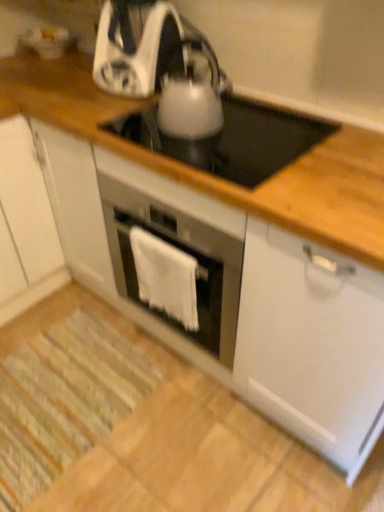
Question: Is point (192, 309) closer or farther from the camera than point (163, 103)?

Choices:
 (A) farther
 (B) closer

Answer: (A)

Question: Considering the positions of white fabric towel at center and satin silver kettle at center, arranged as the 1th kitchen appliance when viewed from the front, in the image, is white fabric towel at center wider or thinner than satin silver kettle at center, arranged as the 1th kitchen appliance when viewed from the front,?

Choices:
 (A) wide
 (B) thin

Answer: (B)

Question: Which object is the farthest from the white fabric towel at center?

Choices:
 (A) satin silver kettle at center, which appears as the 2th kitchen appliance when viewed from the back
 (B) white glossy electric kettle at center
 (C) white matte cabinet at left
 (D) white glossy kettle at upper center, arranged as the 2th kitchen appliance when viewed from the front

Answer: (C)

Question: Which object is positioned closest to the white glossy electric kettle at center?

Choices:
 (A) white glossy kettle at upper center, arranged as the 2th kitchen appliance when viewed from the front
 (B) white fabric towel at center
 (C) white matte cabinet at left
 (D) satin silver kettle at center, which appears as the 2th kitchen appliance when viewed from the back

Answer: (D)